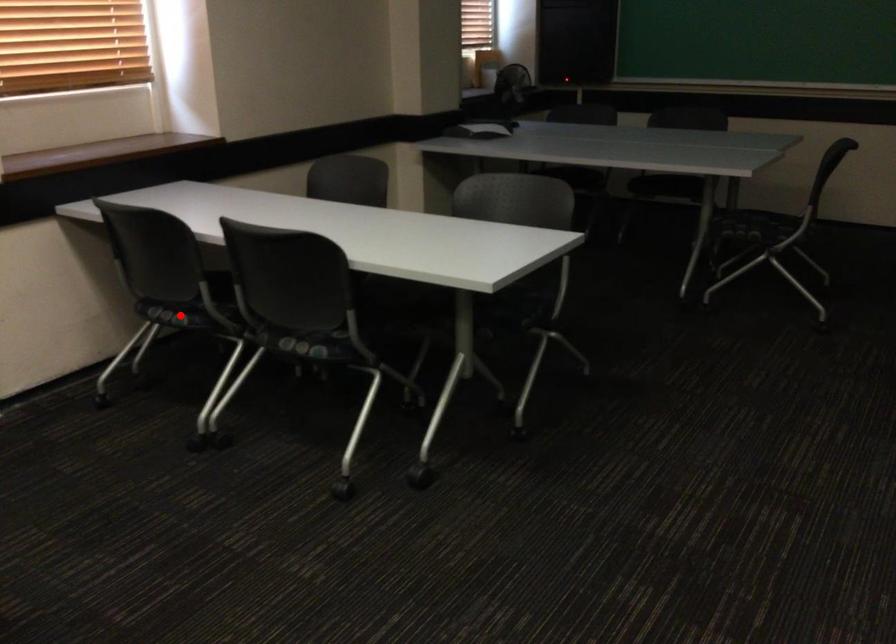
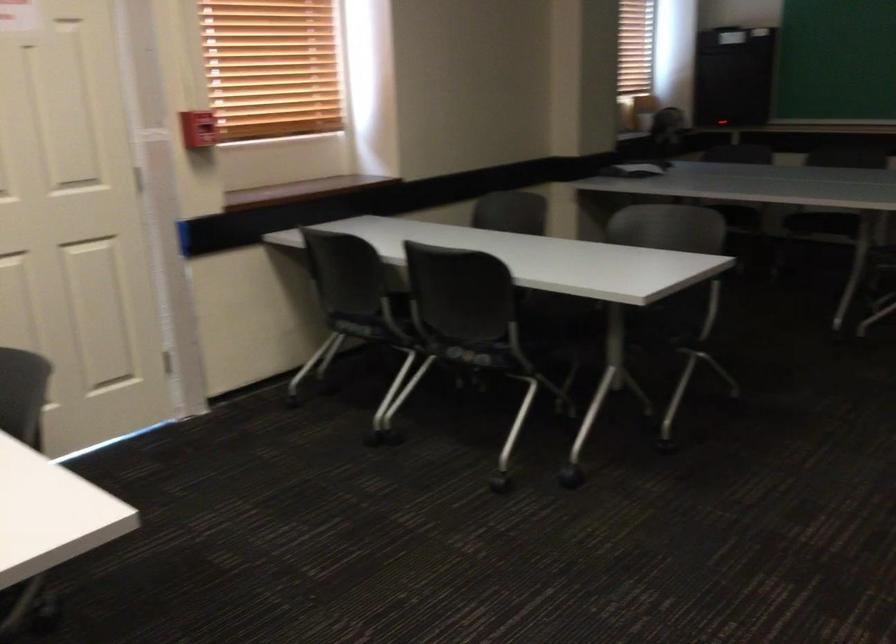
Question: I am providing you with two images of the same scene from different viewpoints. Image1 has a red point marked. In image2, the corresponding 3D location appears at what relative position? Reply with the corresponding letter.

Choices:
 (A) Closer
 (B) Farther

Answer: (B)